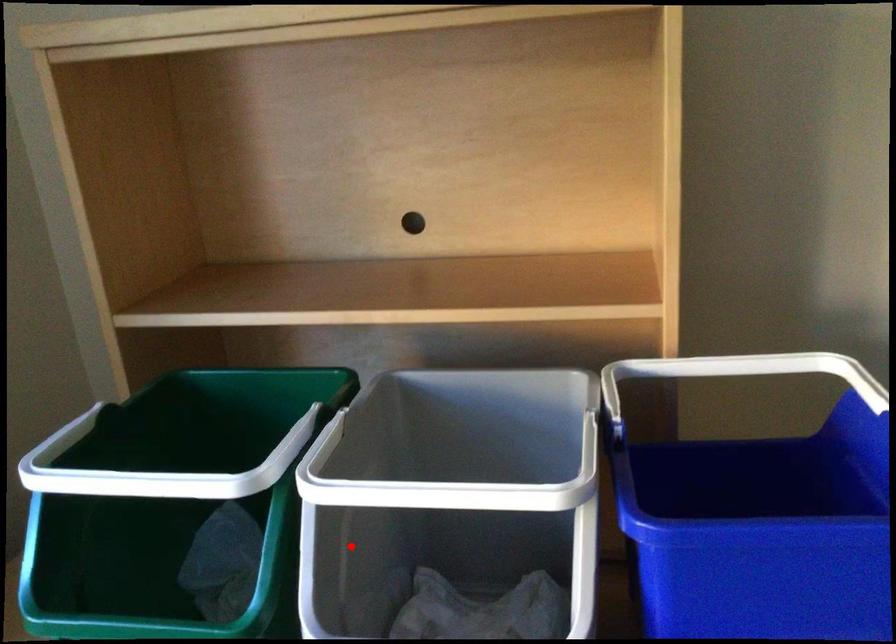
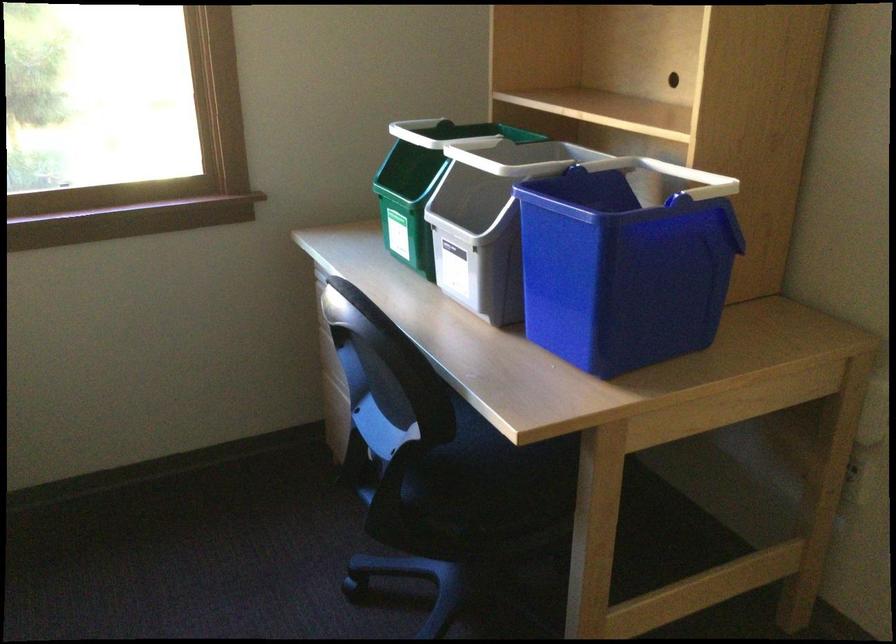
Question: I am providing you with two images of the same scene from different viewpoints. Image1 has a red point marked. In image2, the corresponding 3D location appears at what relative position? Reply with the corresponding letter.

Choices:
 (A) Closer
 (B) Farther

Answer: (B)